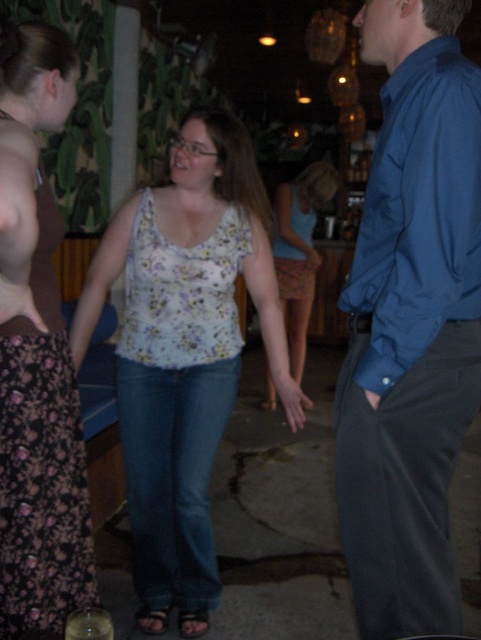
Question: Does blue smooth shirt at right have a smaller size compared to floral fabric tank top at center?

Choices:
 (A) yes
 (B) no

Answer: (B)

Question: Which object is the closest to the blue smooth shirt at right?

Choices:
 (A) floral fabric top at center
 (B) floral fabric dress at left
 (C) floral fabric blouse at center

Answer: (C)

Question: Can you confirm if floral fabric tank top at center is positioned below floral fabric top at center?

Choices:
 (A) yes
 (B) no

Answer: (A)

Question: Is blue smooth shirt at right smaller than floral fabric top at center?

Choices:
 (A) no
 (B) yes

Answer: (B)

Question: Which of the following is the closest to the observer?

Choices:
 (A) (157, 301)
 (B) (432, 563)

Answer: (B)

Question: Which of the following is the farthest from the observer?

Choices:
 (A) (451, 445)
 (B) (161, 248)

Answer: (B)